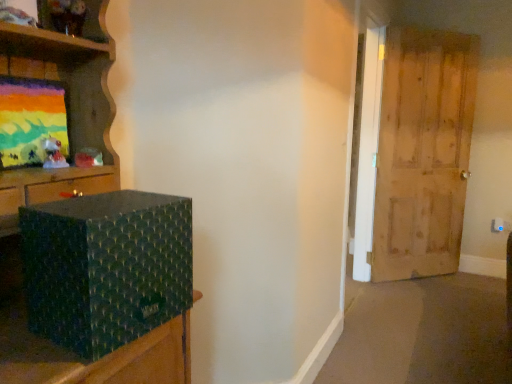
Question: Is green textured box at left positioned far away from wooden door at right?

Choices:
 (A) yes
 (B) no

Answer: (A)

Question: Is green textured box at left aimed at wooden door at right?

Choices:
 (A) no
 (B) yes

Answer: (A)

Question: Is green textured box at left not inside wooden door at right?

Choices:
 (A) no
 (B) yes

Answer: (B)

Question: Considering the relative positions of green textured box at left and wooden door at right in the image provided, is green textured box at left behind wooden door at right?

Choices:
 (A) no
 (B) yes

Answer: (A)

Question: From a real-world perspective, is green textured box at left positioned under wooden door at right based on gravity?

Choices:
 (A) yes
 (B) no

Answer: (A)

Question: Considering the relative positions of green textured box at left and wooden door at right in the image provided, is green textured box at left to the right of wooden door at right from the viewer's perspective?

Choices:
 (A) yes
 (B) no

Answer: (B)

Question: Can you confirm if wooden door at right is thinner than matte painted canvas at upper left?

Choices:
 (A) no
 (B) yes

Answer: (A)

Question: Can you confirm if wooden door at right is smaller than matte painted canvas at upper left?

Choices:
 (A) yes
 (B) no

Answer: (B)

Question: Can you confirm if wooden door at right is wider than matte painted canvas at upper left?

Choices:
 (A) no
 (B) yes

Answer: (B)

Question: Does wooden door at right appear on the left side of matte painted canvas at upper left?

Choices:
 (A) no
 (B) yes

Answer: (A)

Question: Is wooden door at right located outside matte painted canvas at upper left?

Choices:
 (A) no
 (B) yes

Answer: (B)

Question: Considering the relative positions of wooden door at right and matte painted canvas at upper left in the image provided, is wooden door at right behind matte painted canvas at upper left?

Choices:
 (A) yes
 (B) no

Answer: (A)

Question: Considering the relative sizes of wooden door at right and green textured box at left in the image provided, is wooden door at right taller than green textured box at left?

Choices:
 (A) no
 (B) yes

Answer: (B)